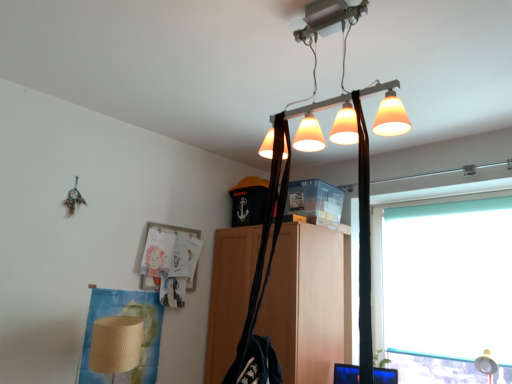
Question: Does metallic gold table lamp at lower right turn towards black fabric shoulder bag at center?

Choices:
 (A) no
 (B) yes

Answer: (B)

Question: Is the position of metallic gold table lamp at lower right less distant than that of black fabric shoulder bag at center?

Choices:
 (A) yes
 (B) no

Answer: (B)

Question: Is metallic gold table lamp at lower right not within black fabric shoulder bag at center?

Choices:
 (A) yes
 (B) no

Answer: (A)

Question: From a real-world perspective, is metallic gold table lamp at lower right on top of black fabric shoulder bag at center?

Choices:
 (A) yes
 (B) no

Answer: (B)

Question: Does metallic gold table lamp at lower right have a lesser height compared to black fabric shoulder bag at center?

Choices:
 (A) yes
 (B) no

Answer: (A)

Question: From the image's perspective, is metallic gold table lamp at lower right located above black fabric shoulder bag at center?

Choices:
 (A) yes
 (B) no

Answer: (B)

Question: Is black fabric shoulder bag at center not close to teal matte window at right?

Choices:
 (A) no
 (B) yes

Answer: (B)

Question: Can you confirm if black fabric shoulder bag at center is taller than teal matte window at right?

Choices:
 (A) no
 (B) yes

Answer: (A)

Question: Is black fabric shoulder bag at center closer to camera compared to teal matte window at right?

Choices:
 (A) yes
 (B) no

Answer: (A)

Question: From a real-world perspective, does black fabric shoulder bag at center stand above teal matte window at right?

Choices:
 (A) no
 (B) yes

Answer: (B)

Question: From the image's perspective, is black fabric shoulder bag at center on top of teal matte window at right?

Choices:
 (A) no
 (B) yes

Answer: (B)

Question: Considering the relative sizes of black fabric shoulder bag at center and teal matte window at right in the image provided, is black fabric shoulder bag at center wider than teal matte window at right?

Choices:
 (A) no
 (B) yes

Answer: (B)

Question: Is matte wood cabinet at center positioned with its back to black fabric shoulder bag at center?

Choices:
 (A) yes
 (B) no

Answer: (B)